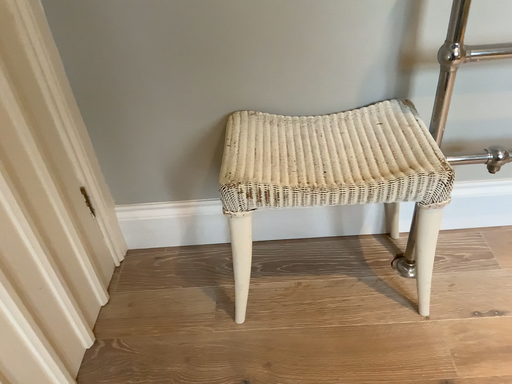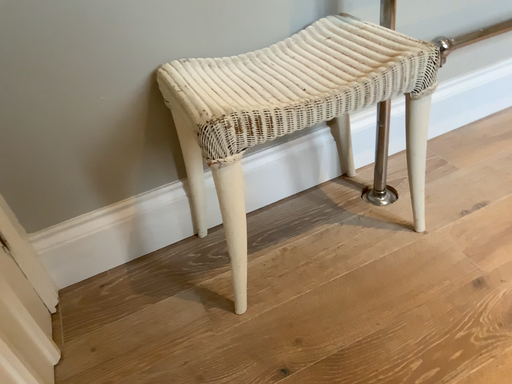
Question: Which way did the camera rotate in the video?

Choices:
 (A) rotated left
 (B) rotated right

Answer: (B)